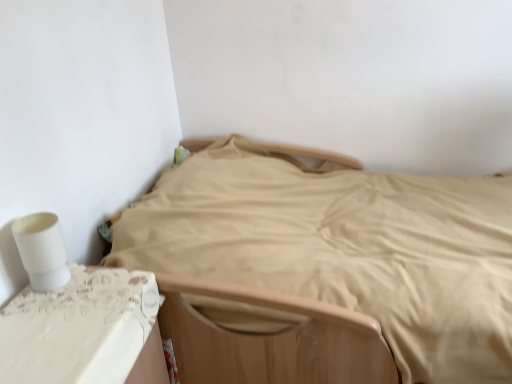
Question: Is white lace table at lower left not inside white matte toilet paper at left?

Choices:
 (A) no
 (B) yes

Answer: (B)

Question: From the image's perspective, does white lace table at lower left appear lower than white matte toilet paper at left?

Choices:
 (A) yes
 (B) no

Answer: (A)

Question: Does white lace table at lower left come behind white matte toilet paper at left?

Choices:
 (A) yes
 (B) no

Answer: (B)

Question: Can you confirm if white lace table at lower left is taller than white matte toilet paper at left?

Choices:
 (A) yes
 (B) no

Answer: (A)

Question: Considering the relative positions of white lace table at lower left and white matte toilet paper at left in the image provided, is white lace table at lower left to the right of white matte toilet paper at left from the viewer's perspective?

Choices:
 (A) no
 (B) yes

Answer: (B)

Question: From a real-world perspective, is white lace table at lower left physically below white matte toilet paper at left?

Choices:
 (A) yes
 (B) no

Answer: (A)

Question: Considering the relative sizes of white lace table at lower left and beige fabric bed at center in the image provided, is white lace table at lower left smaller than beige fabric bed at center?

Choices:
 (A) yes
 (B) no

Answer: (A)

Question: Is white lace table at lower left positioned behind beige fabric bed at center?

Choices:
 (A) no
 (B) yes

Answer: (A)

Question: Is the position of white lace table at lower left less distant than that of beige fabric bed at center?

Choices:
 (A) yes
 (B) no

Answer: (A)

Question: Would you say white lace table at lower left is a long distance from beige fabric bed at center?

Choices:
 (A) no
 (B) yes

Answer: (A)

Question: Considering the relative positions of white lace table at lower left and beige fabric bed at center in the image provided, is white lace table at lower left to the right of beige fabric bed at center from the viewer's perspective?

Choices:
 (A) yes
 (B) no

Answer: (B)

Question: Is white lace table at lower left wider than beige fabric bed at center?

Choices:
 (A) no
 (B) yes

Answer: (A)

Question: Can you confirm if white matte toilet paper at left is positioned to the left of white lace table at lower left?

Choices:
 (A) yes
 (B) no

Answer: (A)